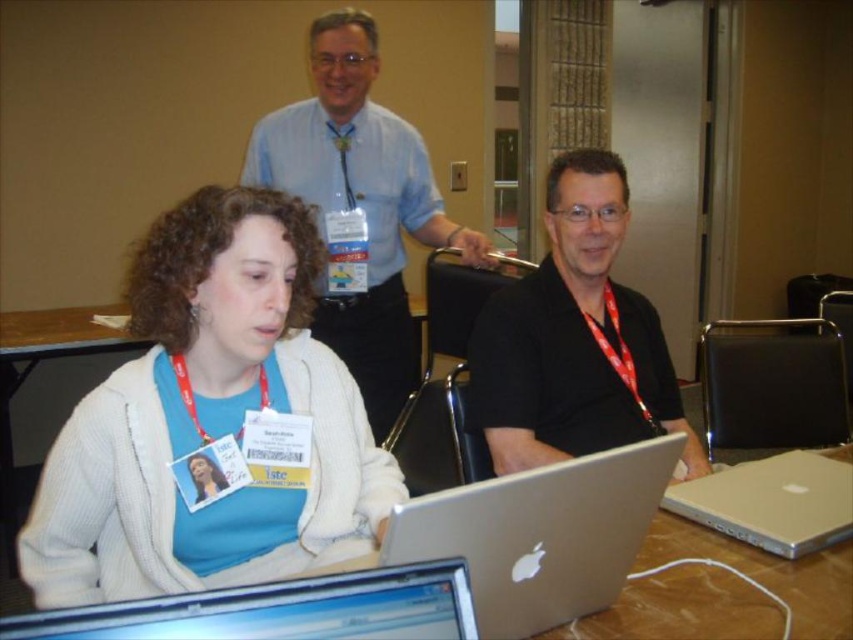
Question: Which point appears farthest from the camera in this image?

Choices:
 (A) (599, 484)
 (B) (297, 144)

Answer: (B)

Question: Can you confirm if silver metallic laptop at center is thinner than silver metallic laptop at lower center?

Choices:
 (A) yes
 (B) no

Answer: (B)

Question: Among these objects, which one is farthest from the camera?

Choices:
 (A) silver metallic laptop at lower center
 (B) white matte sweater at lower left
 (C) silver metallic laptop at center
 (D) light blue shirt at upper center

Answer: (D)

Question: Can you confirm if black matte shirt at center is smaller than silver metallic laptop at lower center?

Choices:
 (A) no
 (B) yes

Answer: (A)

Question: Can you confirm if light blue shirt at upper center is positioned below silver metallic laptop at center?

Choices:
 (A) no
 (B) yes

Answer: (A)

Question: Estimate the real-world distances between objects in this image. Which object is closer to the silver metallic laptop at center?

Choices:
 (A) white matte sweater at lower left
 (B) silver metallic laptop at lower center
 (C) light blue shirt at upper center

Answer: (B)